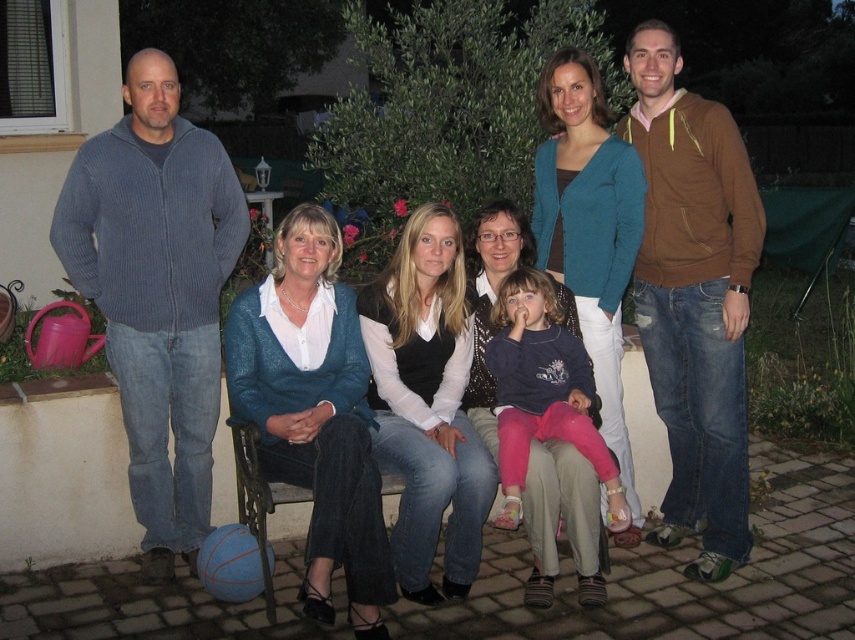
You are organizing a clothing donation drive and need to determine which of the two blue sweaters can fit into a standard donation box that is 18 inches wide. The blue ribbed sweater at left and the matte blue sweater at center are both available. Which one should you choose?

The blue ribbed sweater at left has a larger width than the matte blue sweater at center. Since the donation box is 18 inches wide, the blue ribbed sweater at left may not fit, so the matte blue sweater at center is the better choice.

You are a photographer trying to capture the blue ribbed sweater at left and the matte blue sweater at center in the same frame. Which sweater should you focus on first to ensure both are in the shot?

The blue ribbed sweater at left is positioned over the matte blue sweater at center, so focusing on the blue ribbed sweater at left first will ensure both are in the shot.

You are standing at the center of the image. There is a point marked at coordinates (694, 298). Which object does this point correspond to?

The point at coordinates (694, 298) corresponds to the brown hoodie at right.